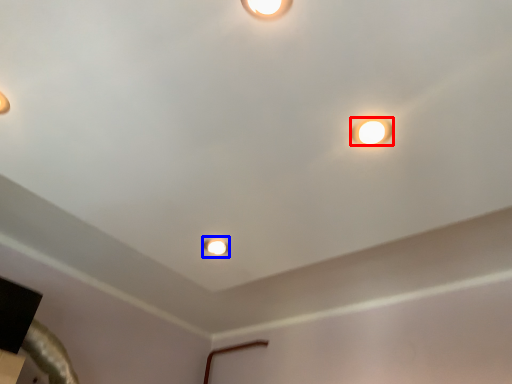
Question: Which object is further to the camera taking this photo, lamp (highlighted by a red box) or stage light (highlighted by a blue box)?

Choices:
 (A) lamp
 (B) stage light

Answer: (B)